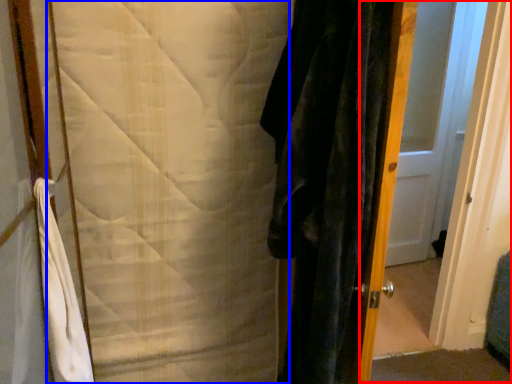
Question: Which point is further to the camera, screen door (highlighted by a red box) or blanket (highlighted by a blue box)?

Choices:
 (A) screen door
 (B) blanket

Answer: (A)